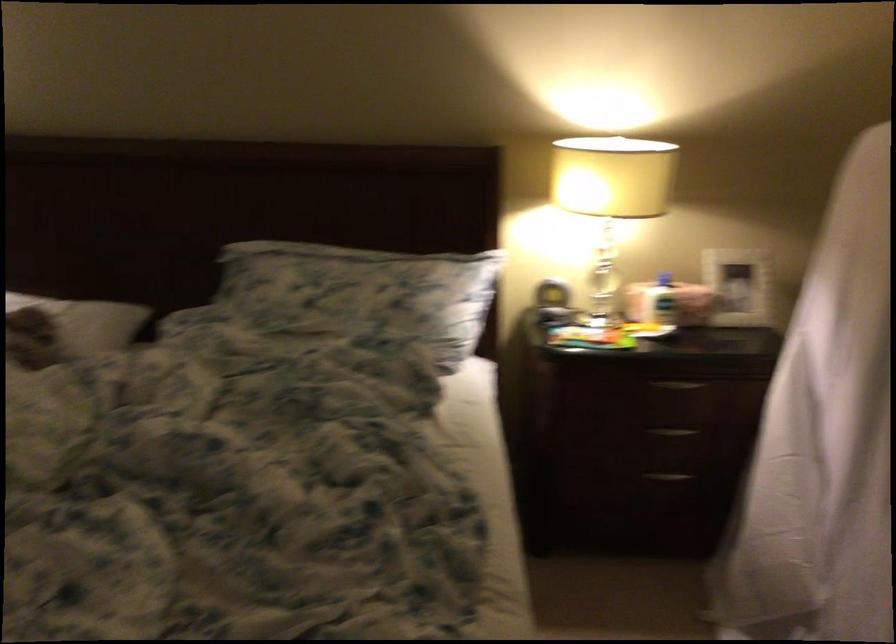
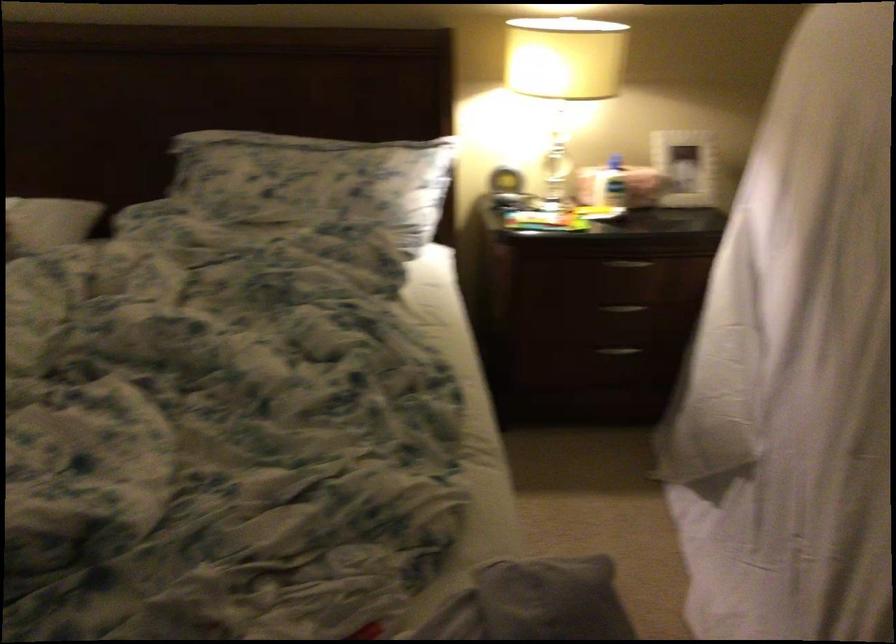
Where in the second image is the point corresponding to (x=675, y=431) from the first image?

(624, 308)